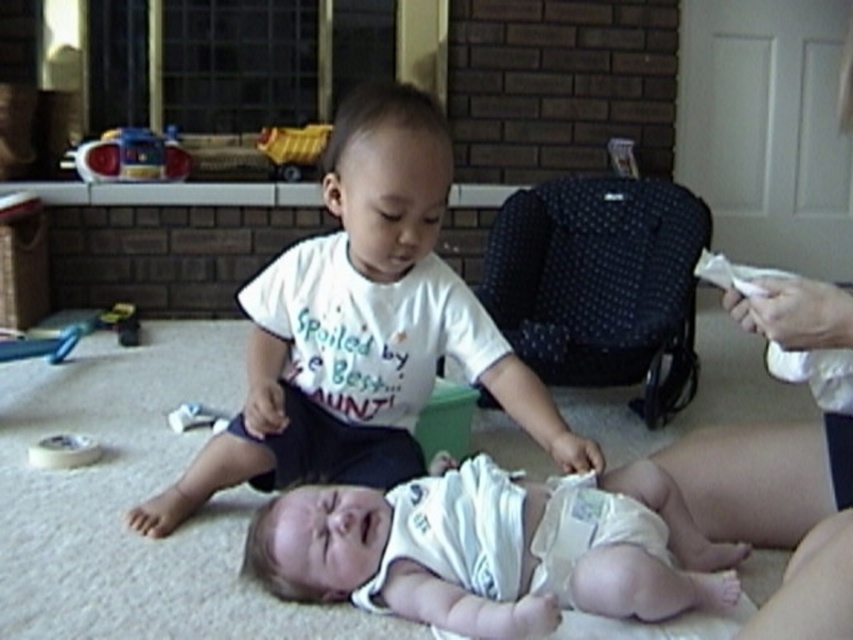
In the scene shown: Between translucent plastic toy at upper left and yellow plastic toy at upper center, which one is positioned higher?

yellow plastic toy at upper center

Between translucent plastic toy at upper left and yellow plastic toy at upper center, which one appears on the left side from the viewer's perspective?

Positioned to the left is translucent plastic toy at upper left.

Which is behind, point (173, 172) or point (300, 161)?

Positioned behind is point (300, 161).

This screenshot has height=640, width=853. Find the location of `translucent plastic toy at upper left`. translucent plastic toy at upper left is located at coordinates (129, 157).

Is white cotton shirt at center further to camera compared to white cloth diaper at center?

Yes, white cotton shirt at center is behind white cloth diaper at center.

Identify the location of white cotton shirt at center. This screenshot has width=853, height=640. (361, 326).

Which is in front, point (509, 403) or point (436, 499)?

Point (436, 499) is in front.

What are the coordinates of `white cotton shirt at center` in the screenshot? It's located at (361, 326).

Is white cotton shirt at center taller than white matte tape at lower left?

Yes.

Is point (379, 176) farther from camera compared to point (77, 438)?

No.

Where is `white cotton shirt at center`? The width and height of the screenshot is (853, 640). white cotton shirt at center is located at coordinates (361, 326).